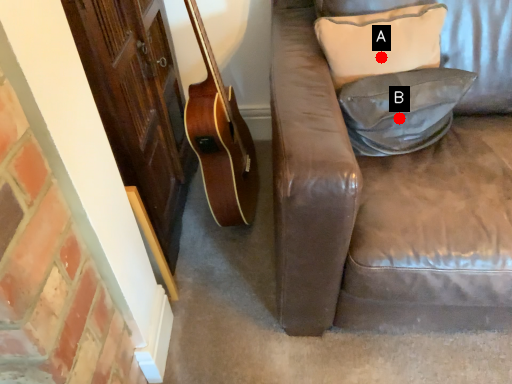
Question: Two points are circled on the image, labeled by A and B beside each circle. Which point appears closest to the camera in this image?

Choices:
 (A) A is closer
 (B) B is closer

Answer: (B)